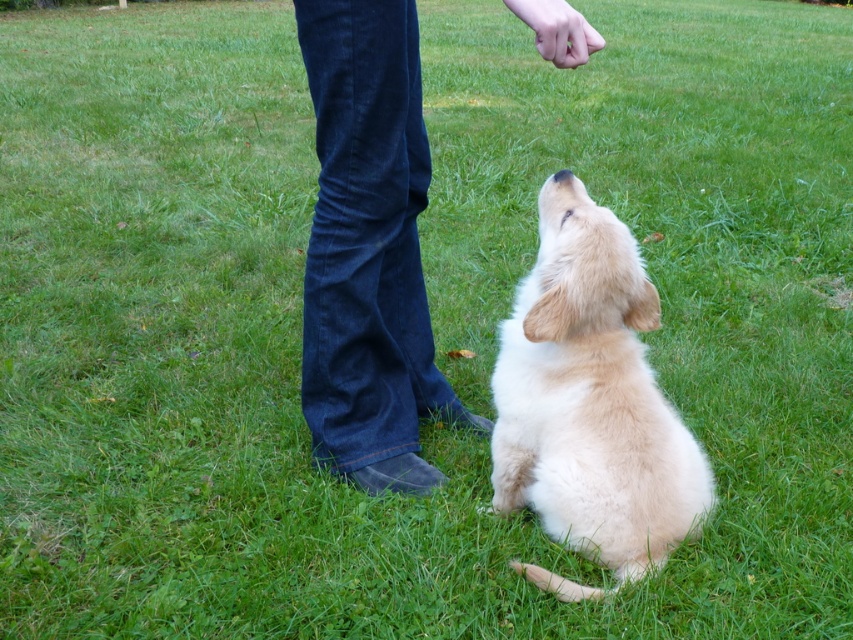
You are a photographer trying to capture a candid shot of the denim jeans at center without being noticed by the person wearing them. You have a camera with a 2.0 meter focal length. Can you take the photo from your current position without moving? Explain your reasoning.

The denim jeans at center and camera are 2.14 meters apart. Since the camera has a 2.0 meter focal length, which is shorter than the distance between them, you cannot capture the denim jeans at center from your current position without moving closer.

You are a photographer trying to capture the interaction between the person and the puppy. You notice the denim jeans at center and the soft golden fur at center. Which object should you focus on first to ensure both are in the frame?

The soft golden fur at center is behind the denim jeans at center, so you should focus on the denim jeans at center first to ensure both are in the frame.

You are a photographer taking a picture of the scene. The denim jeans at center and the soft golden fur at center are both in the frame. Which one is closer to the top of the photo?

The denim jeans at center is located above the soft golden fur at center, so the denim jeans at center is closer to the top of the photo.